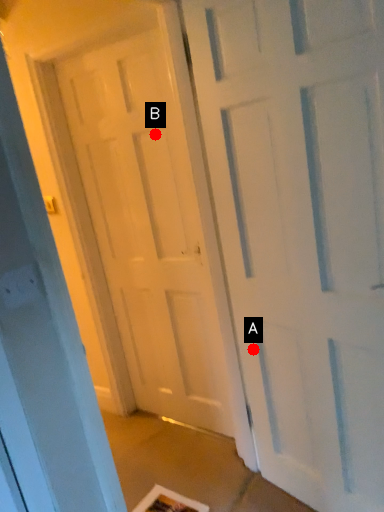
Question: Two points are circled on the image, labeled by A and B beside each circle. Among these points, which one is nearest to the camera?

Choices:
 (A) A is closer
 (B) B is closer

Answer: (A)